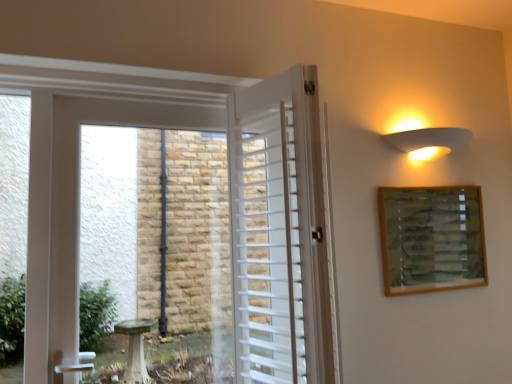
Image resolution: width=512 pixels, height=384 pixels. What do you see at coordinates (428, 142) in the screenshot?
I see `white matte wall sconce at upper right` at bounding box center [428, 142].

At what (x,y) coordinates should I click in order to perform the action: click on white matte wall sconce at upper right. Please return your answer as a coordinate pair (x, y). The height and width of the screenshot is (384, 512). Looking at the image, I should click on (428, 142).

Locate an element on the screen. picture frame located underneath the white matte wall sconce at upper right (from a real-world perspective) is located at coordinates (431, 238).

Based on the photo, would you say white matte wall sconce at upper right is outside wooden picture frame at upper right?

Yes, white matte wall sconce at upper right is not within wooden picture frame at upper right.

Measure the distance from white matte wall sconce at upper right to wooden picture frame at upper right.

The distance of white matte wall sconce at upper right from wooden picture frame at upper right is 11.98 inches.

Is white wooden door at center to the right of wooden picture frame at upper right from the viewer's perspective?

No.

From a real-world perspective, is white wooden door at center beneath wooden picture frame at upper right?

Actually, white wooden door at center is physically above wooden picture frame at upper right in the real world.

Would you say white wooden door at center is inside or outside wooden picture frame at upper right?

white wooden door at center is not enclosed by wooden picture frame at upper right.

Considering the sizes of wooden picture frame at upper right and white wooden door at center in the image, is wooden picture frame at upper right wider or thinner than white wooden door at center?

Clearly, wooden picture frame at upper right has less width compared to white wooden door at center.

Is wooden picture frame at upper right closer to the viewer compared to white wooden door at center?

No, the depth of wooden picture frame at upper right is greater than that of white wooden door at center.

Considering the points (461, 198) and (281, 339), which point is behind, point (461, 198) or point (281, 339)?

Positioned behind is point (461, 198).

From the image's perspective, is wooden picture frame at upper right located beneath white wooden door at center?

Indeed, from the image's perspective, wooden picture frame at upper right is shown beneath white wooden door at center.

Considering the positions of point (461, 239) and point (449, 152), is point (461, 239) closer or farther from the camera than point (449, 152)?

Point (461, 239) is closer to the camera than point (449, 152).

Is wooden picture frame at upper right positioned behind white matte wall sconce at upper right?

Yes, wooden picture frame at upper right is further from the viewer.

Do you think wooden picture frame at upper right is within white matte wall sconce at upper right, or outside of it?

wooden picture frame at upper right is spatially situated outside white matte wall sconce at upper right.

From a real-world perspective, is wooden picture frame at upper right positioned over white matte wall sconce at upper right based on gravity?

No.

Between white matte wall sconce at upper right and white wooden door at center, which one appears on the left side from the viewer's perspective?

From the viewer's perspective, white wooden door at center appears more on the left side.

Is white wooden door at center at the back of white matte wall sconce at upper right?

white matte wall sconce at upper right is not turned away from white wooden door at center.

How far apart are white matte wall sconce at upper right and white wooden door at center?

white matte wall sconce at upper right and white wooden door at center are 63.43 centimeters apart.

Looking at this image, is white wooden door at center surrounded by white matte wall sconce at upper right?

No, white wooden door at center is not surrounded by white matte wall sconce at upper right.

How distant is white wooden door at center from white matte wall sconce at upper right?

white wooden door at center is 24.97 inches away from white matte wall sconce at upper right.

Considering the sizes of objects white wooden door at center and white matte wall sconce at upper right in the image provided, who is thinner, white wooden door at center or white matte wall sconce at upper right?

white matte wall sconce at upper right is thinner.

From the image's perspective, between white wooden door at center and white matte wall sconce at upper right, who is located below?

From the image's view, white wooden door at center is below.

Locate an element on the screen. The height and width of the screenshot is (384, 512). light fixture that is behind the white wooden door at center is located at coordinates (428, 142).

Where is `light fixture to the right of wooden picture frame at upper right`? Image resolution: width=512 pixels, height=384 pixels. light fixture to the right of wooden picture frame at upper right is located at coordinates (428, 142).

Image resolution: width=512 pixels, height=384 pixels. I want to click on picture frame below the white wooden door at center (from the image's perspective), so click(431, 238).

Which object lies nearer to the anchor point wooden picture frame at upper right, white wooden door at center or white matte wall sconce at upper right?

white matte wall sconce at upper right lies closer to wooden picture frame at upper right than the other object.

Looking at the image, which one is located closer to white matte wall sconce at upper right, wooden picture frame at upper right or white wooden door at center?

The object closer to white matte wall sconce at upper right is wooden picture frame at upper right.

Considering their positions, is white matte wall sconce at upper right positioned further to wooden picture frame at upper right than white wooden door at center?

white wooden door at center is further to wooden picture frame at upper right.

From the image, which object appears to be farther from white wooden door at center, wooden picture frame at upper right or white matte wall sconce at upper right?

white matte wall sconce at upper right is positioned further to the anchor white wooden door at center.

Based on their spatial positions, is white matte wall sconce at upper right or wooden picture frame at upper right closer to white wooden door at center?

wooden picture frame at upper right lies closer to white wooden door at center than the other object.

Based on their spatial positions, is white wooden door at center or wooden picture frame at upper right closer to white matte wall sconce at upper right?

wooden picture frame at upper right.

The image size is (512, 384). I want to click on picture frame between white wooden door at center and white matte wall sconce at upper right in the horizontal direction, so click(431, 238).